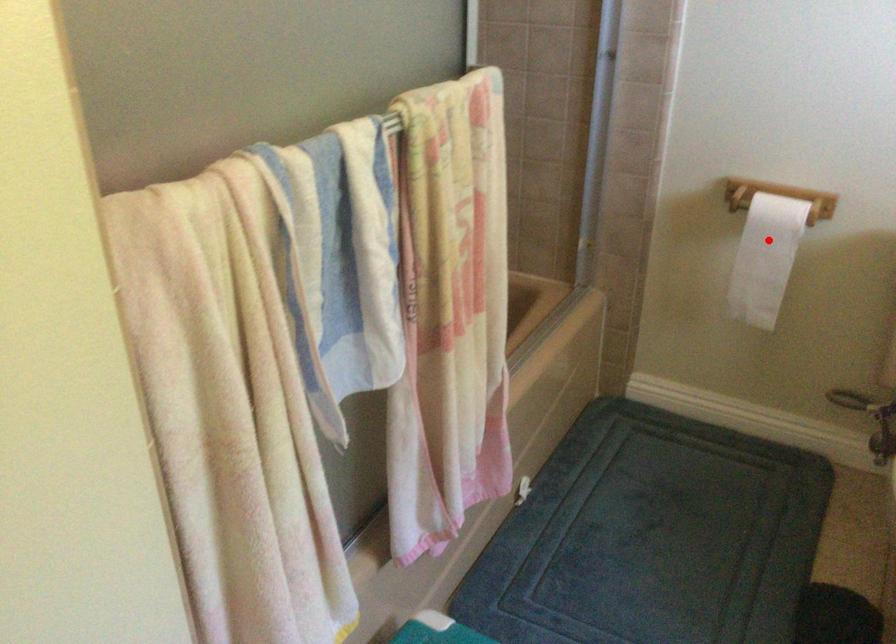
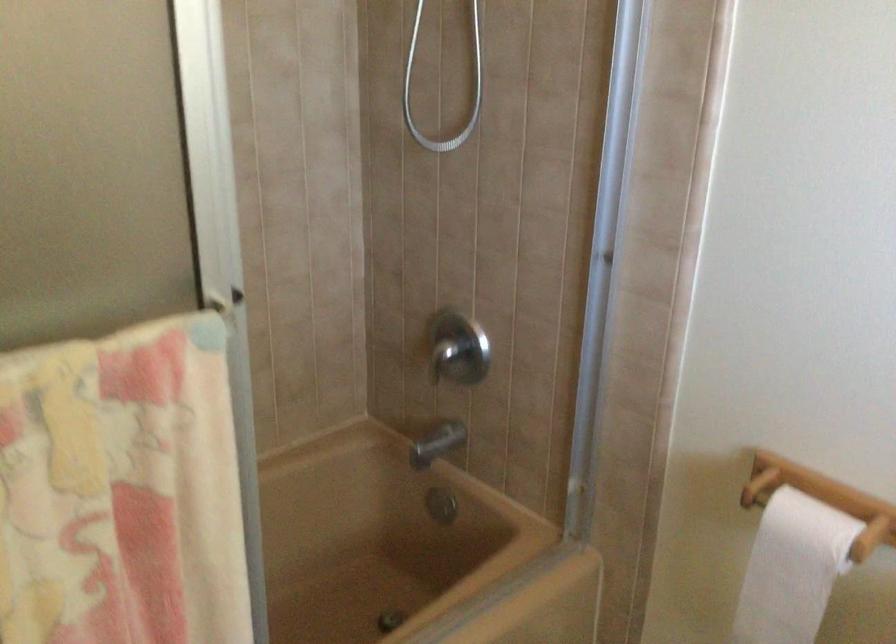
Question: I am providing you with two images of the same scene from different viewpoints. A red point is shown in image1. For the corresponding object point in image2, is it positioned nearer or farther from the camera?

Choices:
 (A) Nearer
 (B) Farther

Answer: (A)